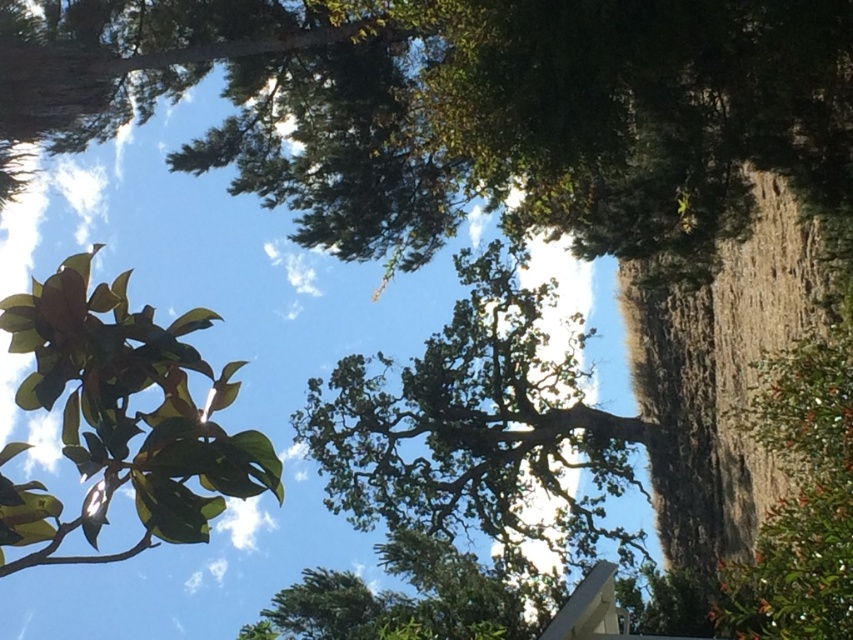
Question: Which object is the farthest from the green glossy leaves at upper left?

Choices:
 (A) green leafy tree at lower right
 (B) green leafy tree at center

Answer: (B)

Question: In this image, where is green glossy leaves at upper left located relative to green leafy tree at lower right?

Choices:
 (A) left
 (B) right

Answer: (A)

Question: Which of the following is the farthest from the observer?

Choices:
 (A) green glossy leaves at upper left
 (B) green leafy tree at center

Answer: (B)

Question: Does green glossy leaves at upper left lie behind green leafy tree at lower right?

Choices:
 (A) yes
 (B) no

Answer: (B)

Question: Which point is closer to the camera?

Choices:
 (A) green glossy leaves at upper left
 (B) green leafy tree at lower right
 (C) green leafy tree at center

Answer: (A)

Question: Is green leafy tree at center below green leafy tree at lower right?

Choices:
 (A) yes
 (B) no

Answer: (A)